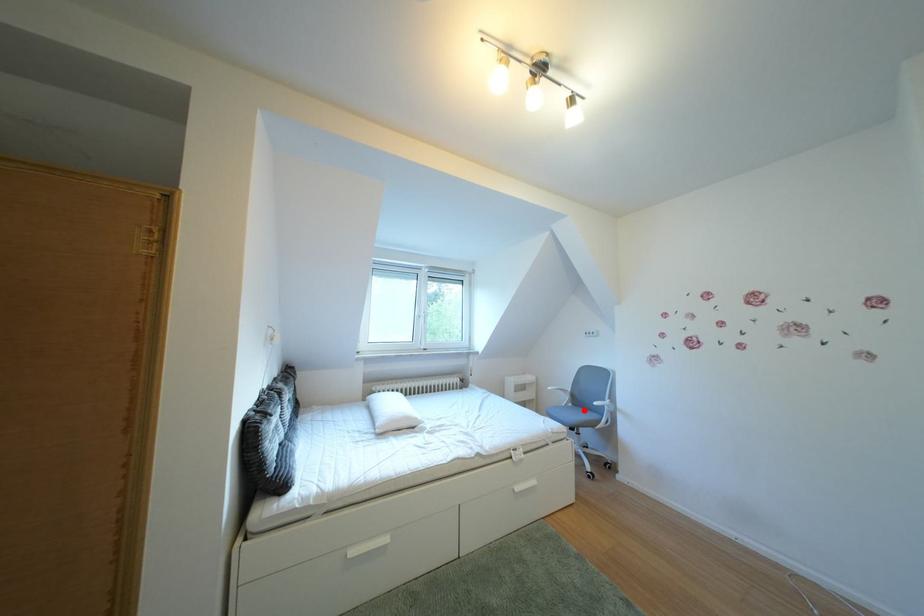
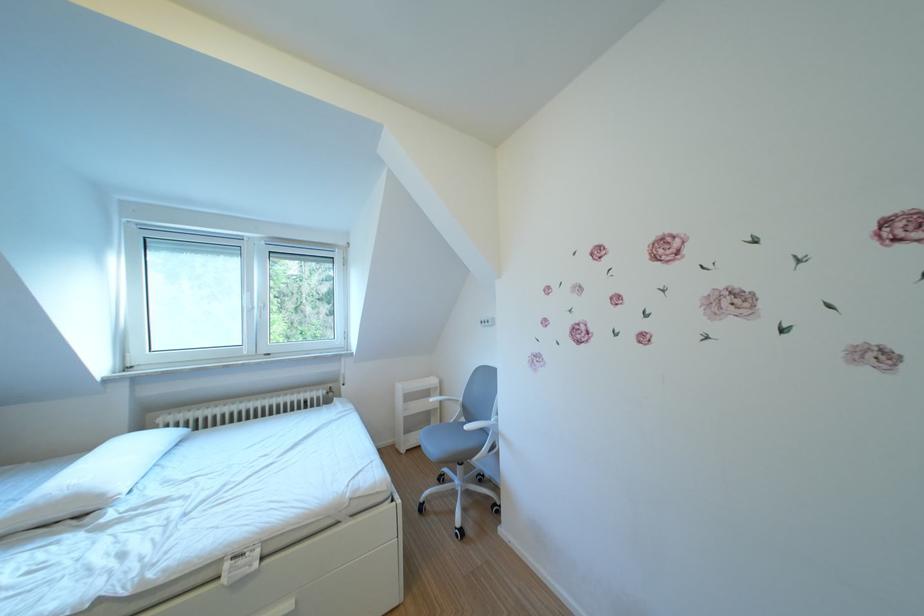
In the second image, find the point that corresponds to the highlighted location in the first image.

(477, 424)